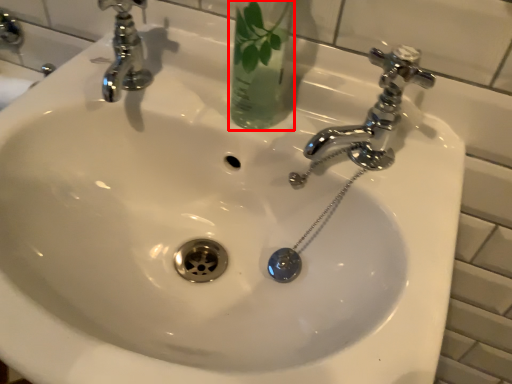
Question: Considering the relative positions of glass vase (annotated by the red box) and tap in the image provided, where is glass vase (annotated by the red box) located with respect to the staircase?

Choices:
 (A) left
 (B) right

Answer: (A)